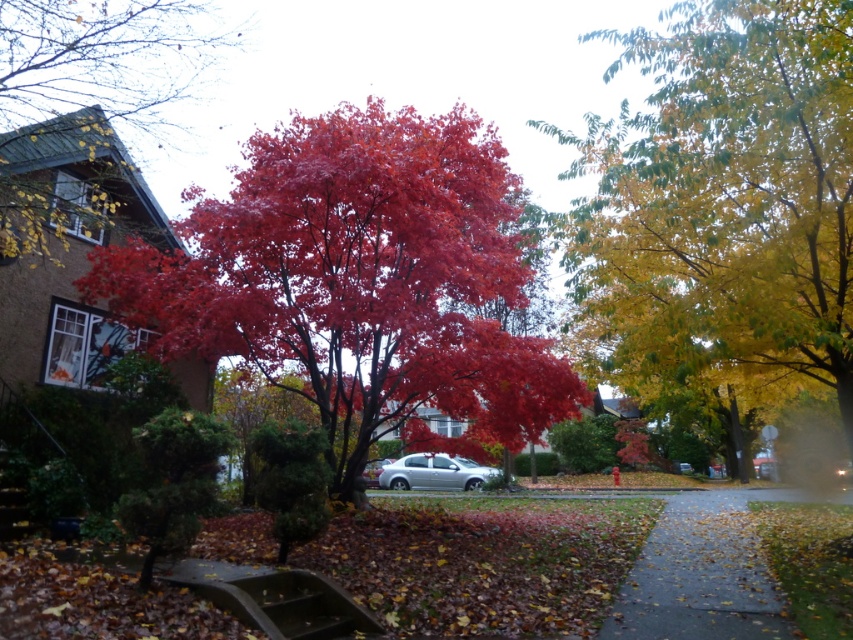
Measure the distance between shiny red maple tree at center and yellow-green leafy tree at right.

shiny red maple tree at center and yellow-green leafy tree at right are 5.71 meters apart from each other.

Does shiny red maple tree at center appear over yellow-green leafy tree at right?

Correct, shiny red maple tree at center is located above yellow-green leafy tree at right.

Is point (407, 346) behind point (657, 184)?

That is True.

The width and height of the screenshot is (853, 640). I want to click on shiny red maple tree at center, so click(358, 282).

Is the position of yellow-green leafy tree at right less distant than that of shiny red maple tree at left?

Yes.

Does yellow-green leafy tree at right have a lesser width compared to shiny red maple tree at left?

No, yellow-green leafy tree at right is not thinner than shiny red maple tree at left.

Where is `yellow-green leafy tree at right`? This screenshot has height=640, width=853. yellow-green leafy tree at right is located at coordinates (722, 200).

I want to click on yellow-green leafy tree at right, so click(x=722, y=200).

Can you confirm if shiny red maple tree at center is positioned above gray asphalt sidewalk at lower right?

Indeed, shiny red maple tree at center is positioned over gray asphalt sidewalk at lower right.

The height and width of the screenshot is (640, 853). I want to click on shiny red maple tree at center, so click(358, 282).

Is point (296, 291) closer to viewer compared to point (682, 541)?

No, (296, 291) is further to viewer.

What are the coordinates of `shiny red maple tree at center` in the screenshot? It's located at (358, 282).